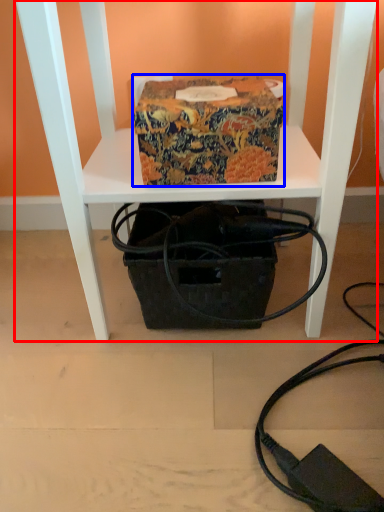
Question: Which object appears closest to the camera in this image, furniture (highlighted by a red box) or cardboard box (highlighted by a blue box)?

Choices:
 (A) furniture
 (B) cardboard box

Answer: (A)